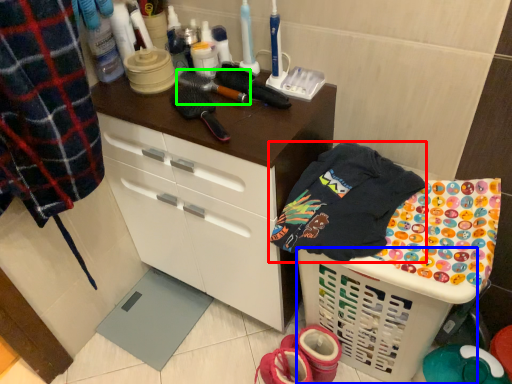
Question: Which object is positioned farthest from clothing (highlighted by a red box)? Select from basket (highlighted by a blue box) and brush (highlighted by a green box).

Choices:
 (A) basket
 (B) brush

Answer: (B)